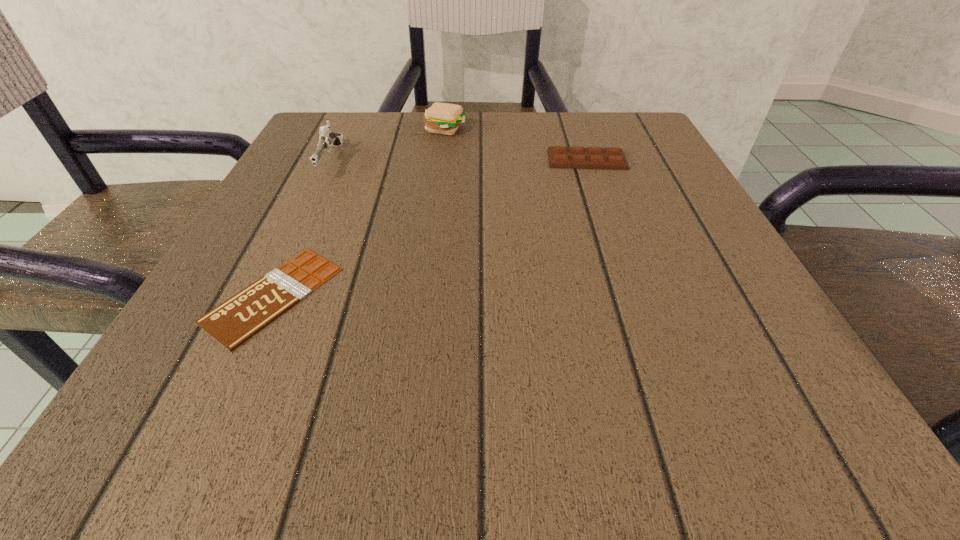
Locate an element on the screen. The width and height of the screenshot is (960, 540). the tallest object is located at coordinates (327, 138).

At what (x,y) coordinates should I click in order to perform the action: click on patty. Please return your answer as a coordinate pair (x, y). Looking at the image, I should click on (443, 118).

Where is `the farthest object`? The image size is (960, 540). the farthest object is located at coordinates (443, 118).

Locate an element on the screen. Image resolution: width=960 pixels, height=540 pixels. the right chocolate bar is located at coordinates (612, 158).

You are a GUI agent. You are given a task and a screenshot of the screen. Output one action in this format:
    pyautogui.click(x=<x>, y=<y>)
    Task: Click on the second shortest object
    This screenshot has height=540, width=960.
    Given the screenshot: What is the action you would take?
    pyautogui.click(x=612, y=158)

I want to click on the left chocolate bar, so (237, 319).

The height and width of the screenshot is (540, 960). In order to click on the nearer chocolate bar in this screenshot , I will do `click(237, 319)`.

Where is `vacant space located aimed along the barrel of the gun`? vacant space located aimed along the barrel of the gun is located at coordinates click(282, 261).

This screenshot has width=960, height=540. In order to click on vacant space located on the front of the patty in this screenshot , I will do `click(442, 161)`.

The image size is (960, 540). In order to click on vacant space positioned 0.190m on the front of the taller chocolate bar in this screenshot , I will do `click(612, 234)`.